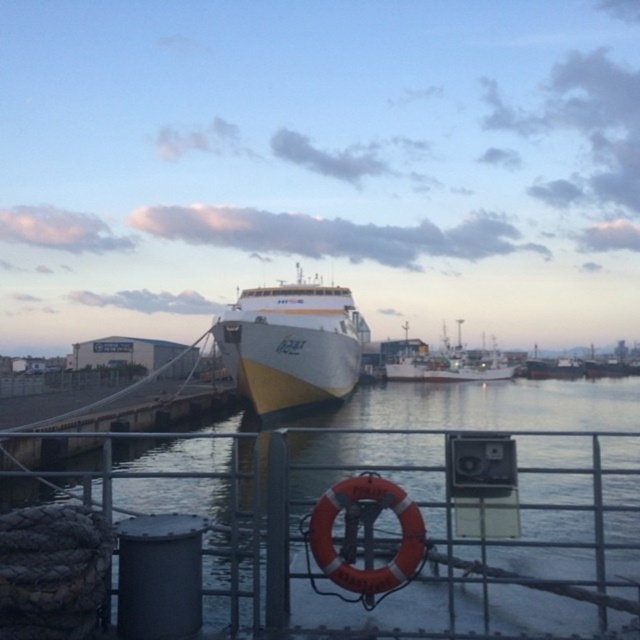
Question: Which point is closer to the camera?

Choices:
 (A) (284, 337)
 (B) (236, 468)

Answer: (B)

Question: Does white glossy ferry at center appear under white matte fishing boat at center?

Choices:
 (A) yes
 (B) no

Answer: (B)

Question: Can you confirm if metal/rustic rail at center is positioned below white glossy ferry at center?

Choices:
 (A) no
 (B) yes

Answer: (B)

Question: Which point is farther from the camera taking this photo?

Choices:
 (A) (184, 564)
 (B) (500, 372)
 (C) (321, 282)

Answer: (B)

Question: Does metal/rustic rail at center have a larger size compared to white matte fishing boat at center?

Choices:
 (A) no
 (B) yes

Answer: (A)

Question: Which point is closer to the camera?

Choices:
 (A) (346, 294)
 (B) (230, 448)
 (C) (451, 346)

Answer: (B)